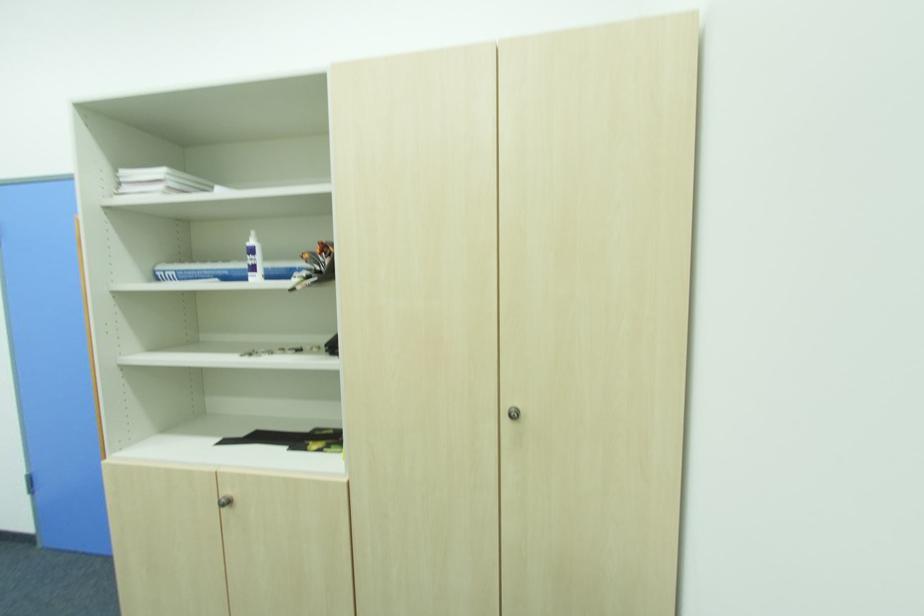
Which object does [314,265] point to?

This point indicates the orange handled tool.